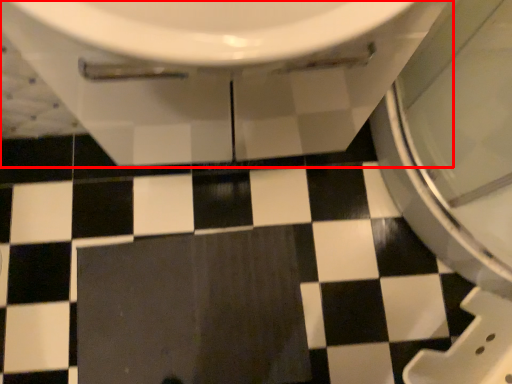
Question: From the image's perspective, where is toilet (annotated by the red box) located relative to ceramic tile?

Choices:
 (A) above
 (B) below

Answer: (A)